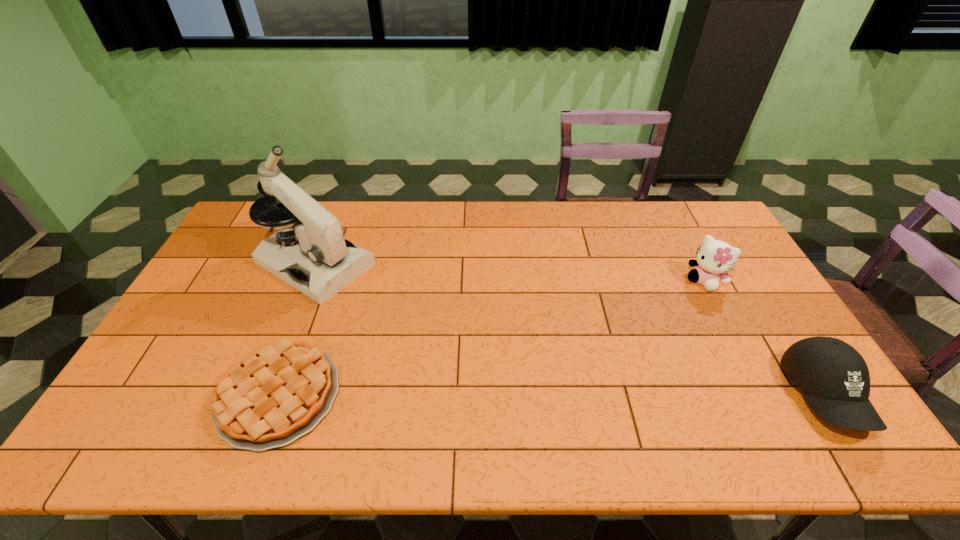
The height and width of the screenshot is (540, 960). Find the location of `vacant spot on the desktop that is between the shortest object and the third tallest object and is positioned on the front-facing side of the second object from right to left`. vacant spot on the desktop that is between the shortest object and the third tallest object and is positioned on the front-facing side of the second object from right to left is located at coordinates (601, 395).

What are the coordinates of `vacant space on the desktop that is between the pie and the second shortest object and is positioned at the eyepiece of the tallest object` in the screenshot? It's located at (541, 395).